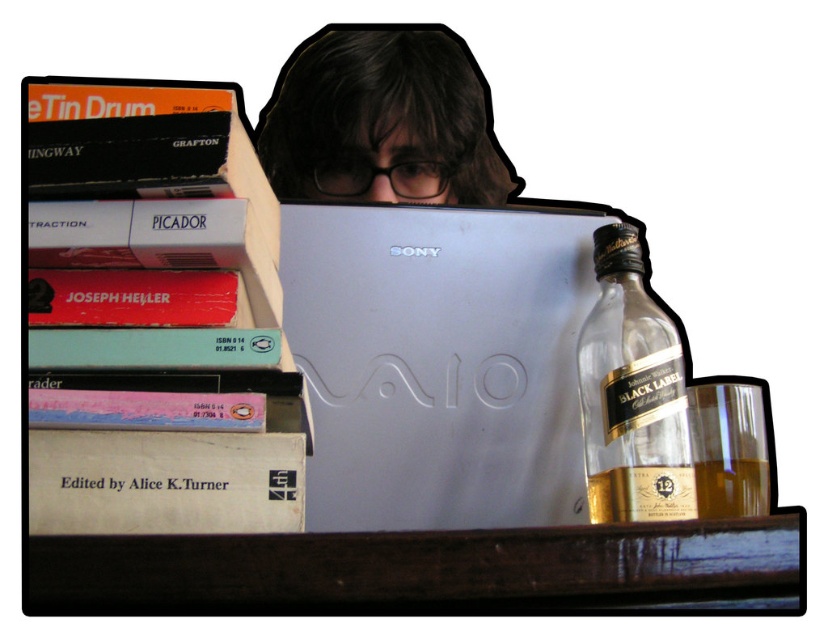
Between silver metallic laptop at center and clear glass bottle at right, which one has more height?

silver metallic laptop at center

Who is positioned more to the left, silver metallic laptop at center or clear glass bottle at right?

silver metallic laptop at center

Looking at this image, who is more forward, (313, 440) or (644, 339)?

Point (313, 440)

The width and height of the screenshot is (828, 640). I want to click on silver metallic laptop at center, so click(x=439, y=362).

Does dark brown hair at center appear under golden glass bottle at right?

No.

Can you confirm if dark brown hair at center is wider than golden glass bottle at right?

Indeed, dark brown hair at center has a greater width compared to golden glass bottle at right.

Is point (326, 35) farther from viewer compared to point (619, 486)?

Yes, point (326, 35) is behind point (619, 486).

Find the location of a particular element. The height and width of the screenshot is (640, 828). dark brown hair at center is located at coordinates (383, 115).

Is point (422, 289) farther from viewer compared to point (658, 518)?

Yes, it is.

Which is in front, point (469, 461) or point (662, 515)?

Point (662, 515)

At what (x,y) coordinates should I click in order to perform the action: click on silver metallic laptop at center. Please return your answer as a coordinate pair (x, y). The height and width of the screenshot is (640, 828). Looking at the image, I should click on (439, 362).